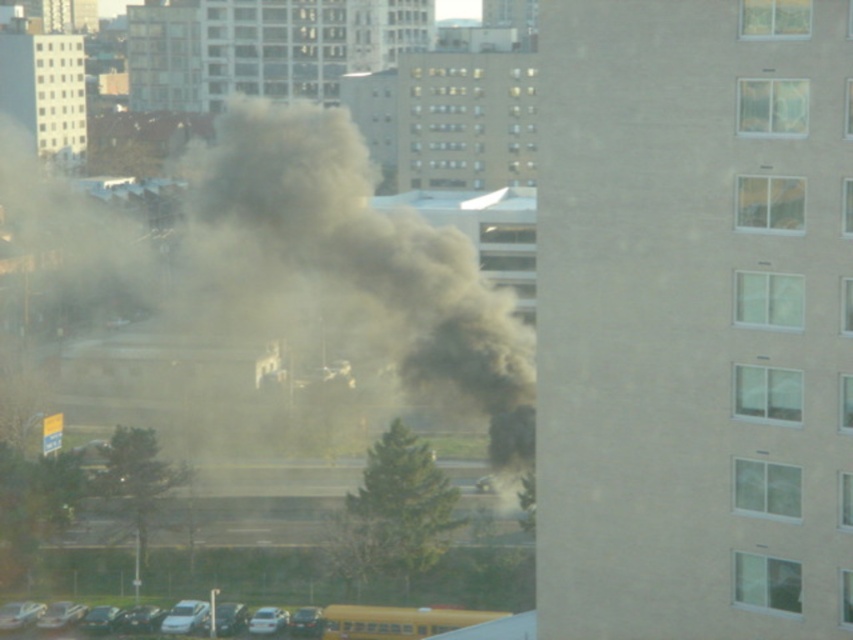
You are standing in the parking lot and want to walk from point A to point B. Point A is at coordinates point (233, 195) and point B is at coordinates point (381, 611). Which point is closer to you when you start walking?

Point A at coordinates point (233, 195) is closer to you because it is further to the viewer than point B at coordinates point (381, 611), meaning it is physically nearer in the scene.

You are a drone operator trying to navigate through the urban area shown in the image. The point marked at coordinates (346, 266) indicates a specific location. What is the most prominent feature at that coordinate?

The point at coordinates (346, 266) marks gray dense smoke at center.